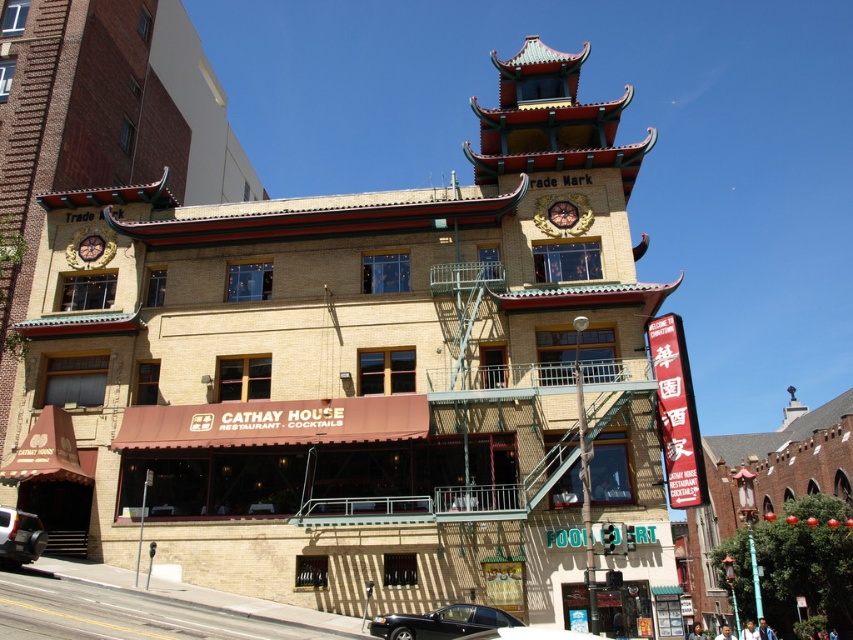
Which is behind, point (569, 209) or point (96, 252)?

Positioned behind is point (96, 252).

Can you confirm if gold metallic clock at upper center is positioned below gold metallic clock at upper left?

No.

Where is `gold metallic clock at upper center`? This screenshot has width=853, height=640. gold metallic clock at upper center is located at coordinates (563, 212).

Where is `gold metallic clock at upper center`? The width and height of the screenshot is (853, 640). gold metallic clock at upper center is located at coordinates (563, 212).

Consider the image. Measure the distance between silver metallic car at lower left and camera.

34.22 meters

Can you confirm if silver metallic car at lower left is positioned above black glossy car at lower center?

Yes.

Where is `silver metallic car at lower left`? silver metallic car at lower left is located at coordinates (19, 536).

Between point (393, 625) and point (558, 221), which one is positioned in front?

Point (393, 625) is in front.

Based on the photo, is shiny black sedan at lower center to the right of gold metallic clock at upper center from the viewer's perspective?

Incorrect, shiny black sedan at lower center is not on the right side of gold metallic clock at upper center.

Locate an element on the screen. This screenshot has height=640, width=853. shiny black sedan at lower center is located at coordinates (440, 621).